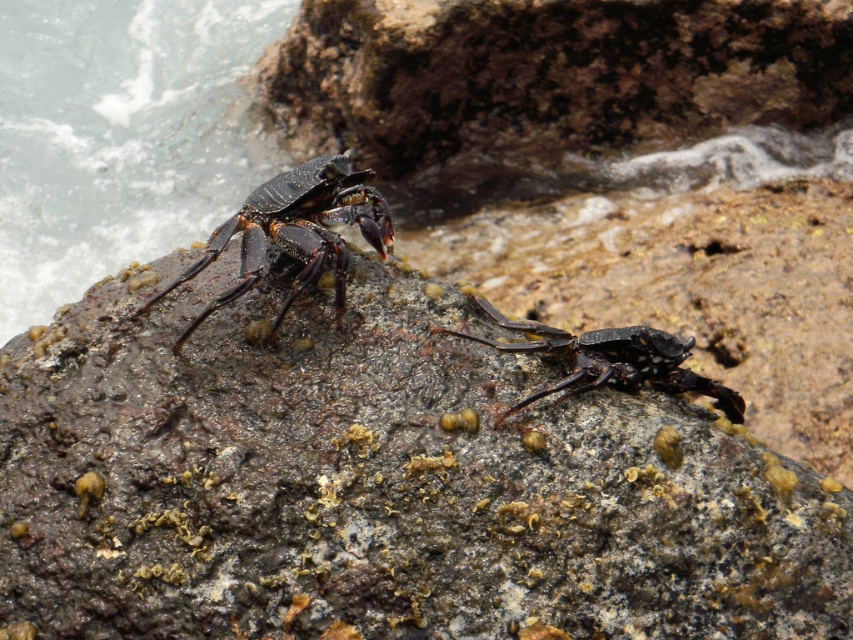
You are a photographer trying to capture a close shot of the shiny black crab at upper left. However, you notice the rough textured rock at center is blocking your view. Can you adjust your position to get a clear shot without moving the rock?

The rough textured rock at center is closer to the viewer than the shiny black crab at upper left, so you can move your position slightly to the side or lower your camera angle to go around the rock and capture the crab without moving the rock.

You are standing at a point 3.51 meters away from the point marked at coordinates point (164, 156). If you want to move closer to that point, which direction should you walk? Please provide your answer in terms of cardinal directions like north, south, east, west, or combinations thereof.

The point marked at coordinates point (164, 156) is located to the north of your current position. To move closer to it, you should walk north.

You are a photographer trying to capture the shiny black crab at upper left. The rough textured rock at center is blocking your view. Can you move the rock to get a clear shot of the crab?

The rough textured rock at center is taller than the shiny black crab at upper left, so moving the rock would allow you to see the crab clearly.